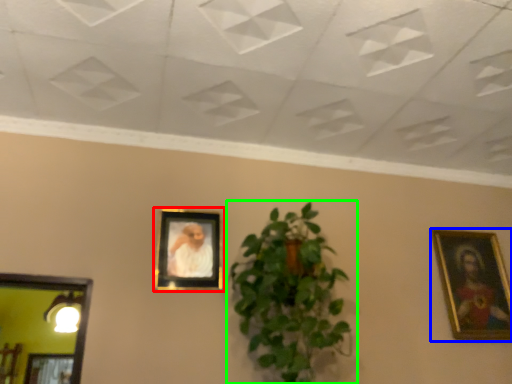
Question: Estimate the real-world distances between objects in this image. Which object is closer to picture frame (highlighted by a red box), picture frame (highlighted by a blue box) or houseplant (highlighted by a green box)?

Choices:
 (A) picture frame
 (B) houseplant

Answer: (B)